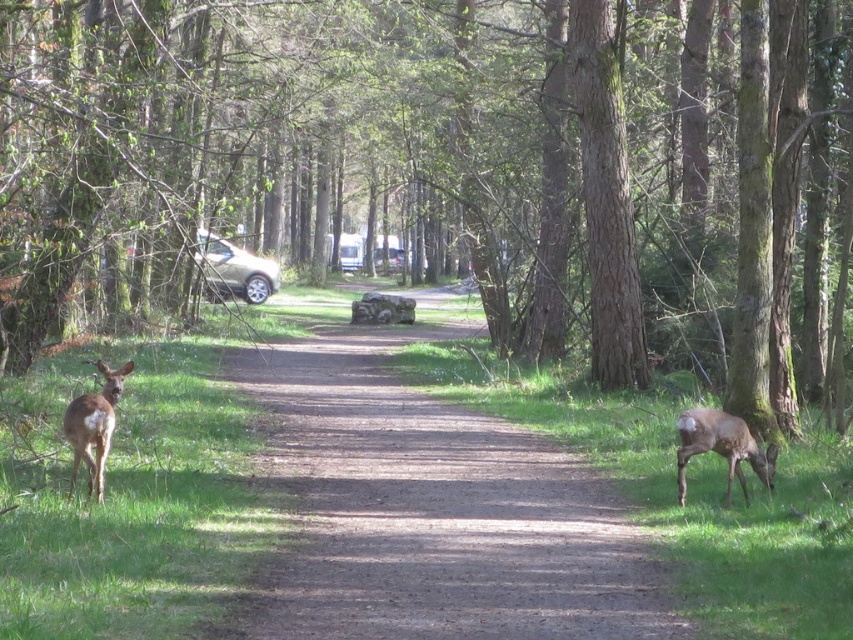
You are a hiker walking along the dirt path in the forest. You see the brown textured tree at center and the brown furry deer at left. Which object is higher in the scene?

The brown textured tree at center is higher than the brown furry deer at left.